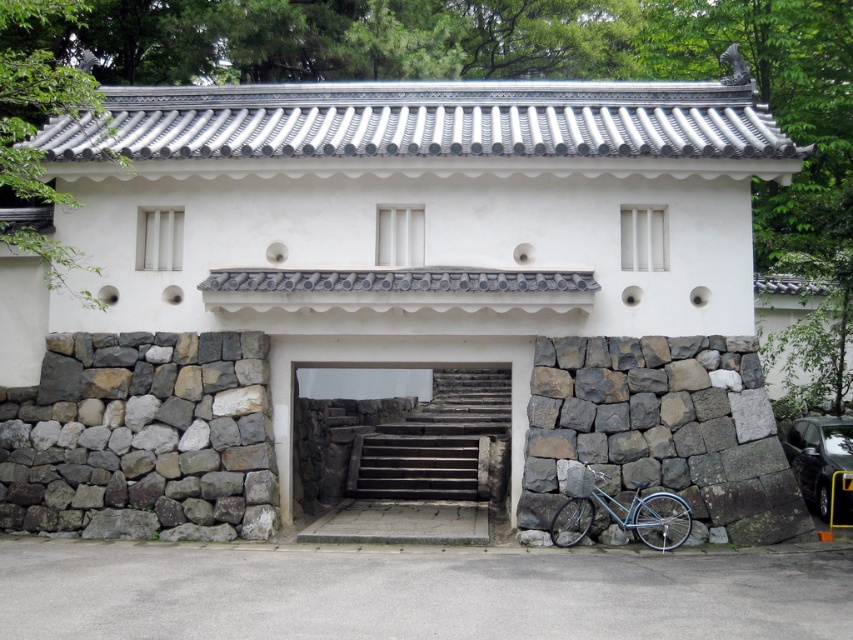
Between gray rough stone wall at lower left and stone stairs at center, which one is positioned higher?

gray rough stone wall at lower left is higher up.

Can you confirm if gray rough stone wall at lower left is wider than stone stairs at center?

Indeed, gray rough stone wall at lower left has a greater width compared to stone stairs at center.

Who is more forward, (169, 490) or (431, 346)?

Positioned in front is point (169, 490).

What are the coordinates of `gray rough stone wall at lower left` in the screenshot? It's located at (142, 436).

This screenshot has width=853, height=640. Identify the location of stone stairs at center. (397, 365).

Who is more forward, (453, 353) or (625, 508)?

Point (625, 508) is in front.

Locate an element on the screen. stone stairs at center is located at coordinates (397, 365).

Does gray rough stone wall at lower left have a smaller size compared to metallic blue bicycle at lower right?

Incorrect, gray rough stone wall at lower left is not smaller in size than metallic blue bicycle at lower right.

Does gray rough stone wall at lower left have a lesser width compared to metallic blue bicycle at lower right?

In fact, gray rough stone wall at lower left might be wider than metallic blue bicycle at lower right.

Measure the distance between gray rough stone wall at lower left and camera.

gray rough stone wall at lower left is 11.82 meters away from camera.

At what (x,y) coordinates should I click in order to perform the action: click on gray rough stone wall at lower left. Please return your answer as a coordinate pair (x, y). Looking at the image, I should click on click(x=142, y=436).